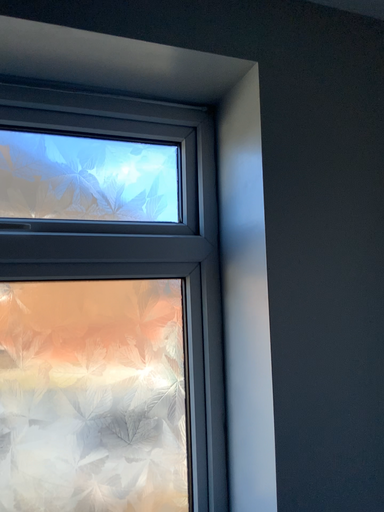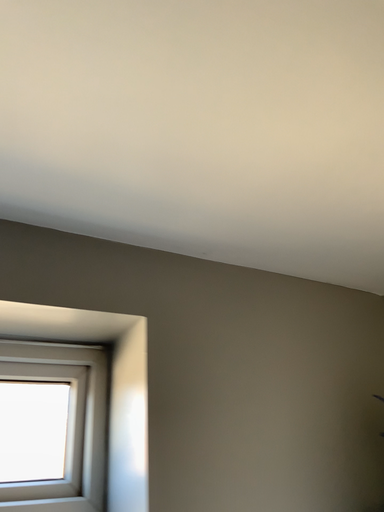
Question: Which way did the camera rotate in the video?

Choices:
 (A) rotated right
 (B) rotated left

Answer: (A)